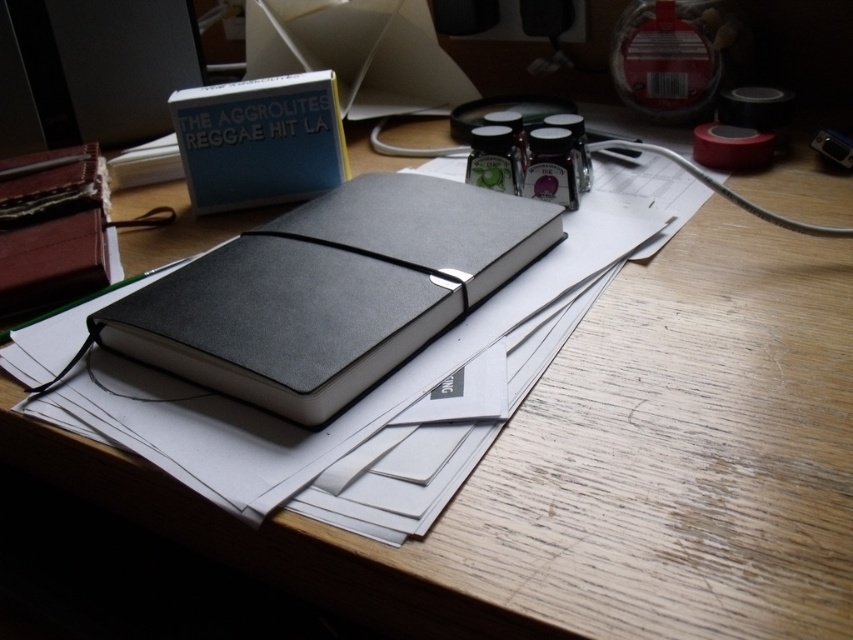
Question: Can you confirm if matte black notebook at center is positioned to the right of matte black notebook at upper left?

Choices:
 (A) no
 (B) yes

Answer: (B)

Question: Among these points, which one is farthest from the camera?

Choices:
 (A) (224, 330)
 (B) (193, 113)

Answer: (B)

Question: Which of the following is the farthest from the observer?

Choices:
 (A) matte black notebook at center
 (B) matte black notebook at upper left

Answer: (B)

Question: Is matte black notebook at center wider than matte black notebook at upper left?

Choices:
 (A) yes
 (B) no

Answer: (A)

Question: Which of the following is the closest to the observer?

Choices:
 (A) matte black notebook at upper left
 (B) matte black notebook at center

Answer: (B)

Question: Can you confirm if matte black notebook at center is smaller than matte black notebook at upper left?

Choices:
 (A) yes
 (B) no

Answer: (B)